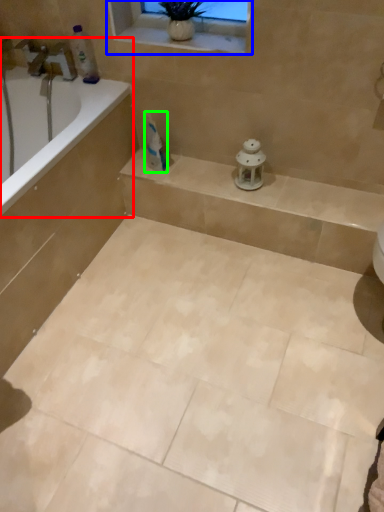
Question: Which is farther away from bathtub (highlighted by a red box)? window frame (highlighted by a blue box) or toothpaste (highlighted by a green box)?

Choices:
 (A) window frame
 (B) toothpaste

Answer: (A)